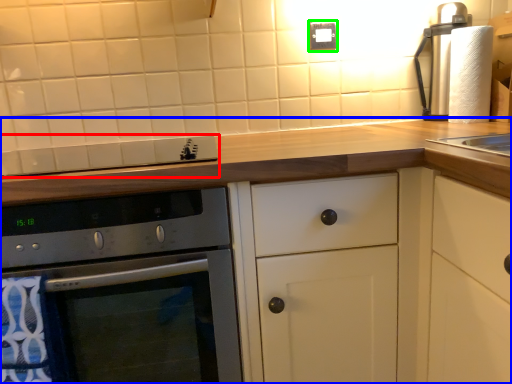
Question: Based on their relative distances, which object is farther from gas stove (highlighted by a red box)? Choose from cabinetry (highlighted by a blue box) and electric outlet (highlighted by a green box).

Choices:
 (A) cabinetry
 (B) electric outlet

Answer: (B)